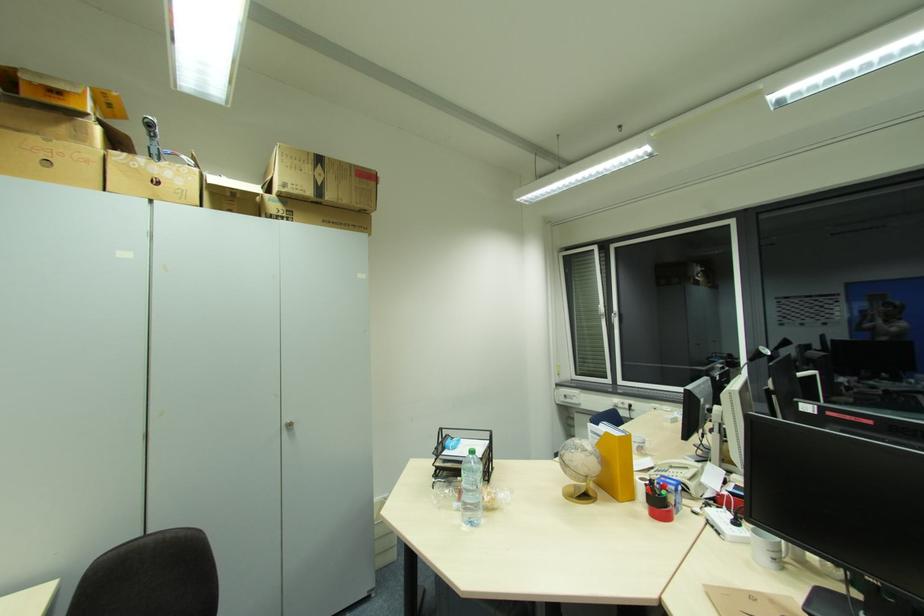
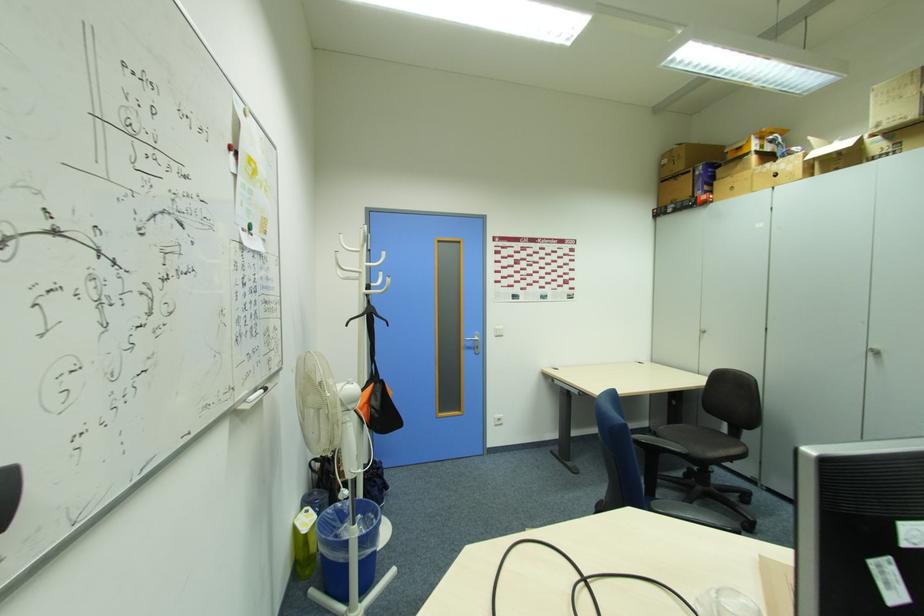
Where in the second image is the point corresponding to [160,184] from the first image?

(779, 176)